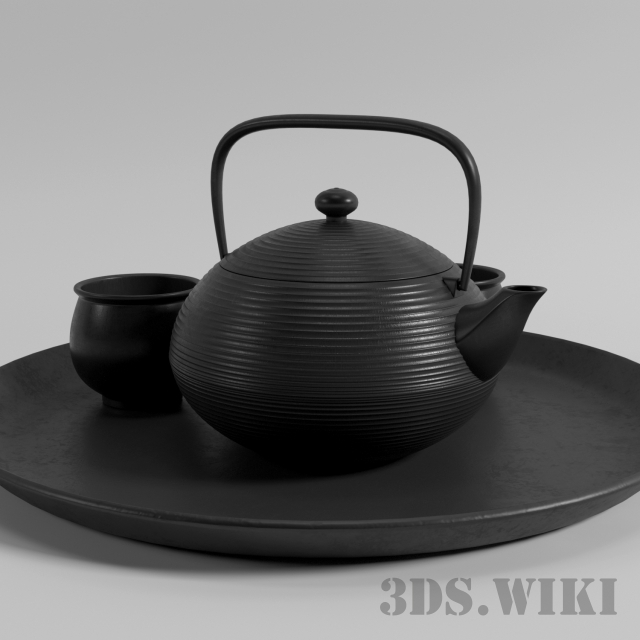
This screenshot has width=640, height=640. Identify the location of tea kettle. (349, 313).